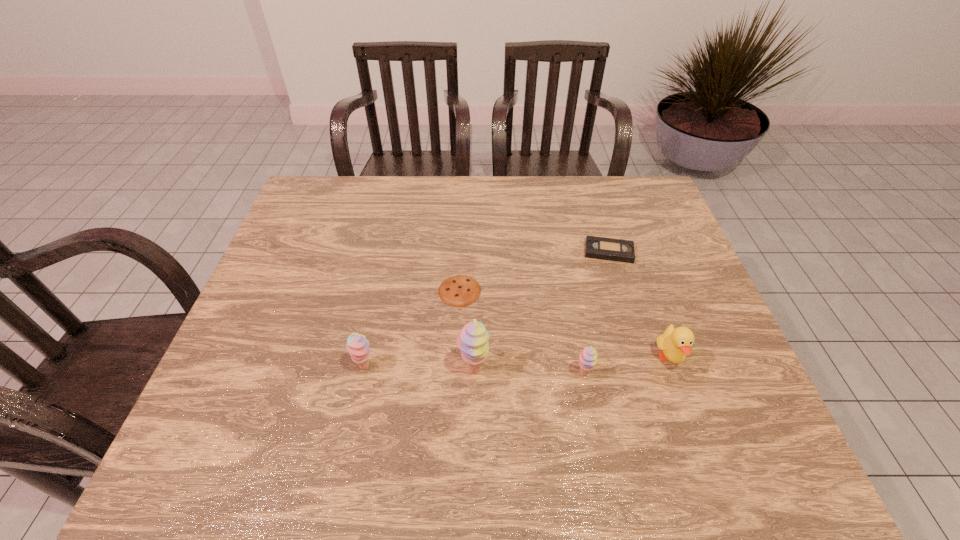
Find the location of a particular element. The height and width of the screenshot is (540, 960). vacant spot to place a sherbert on the right is located at coordinates (694, 377).